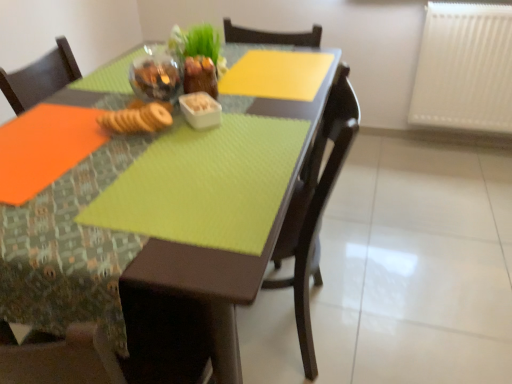
I want to click on vacant area to the right of matte brown chair at center, so click(x=391, y=308).